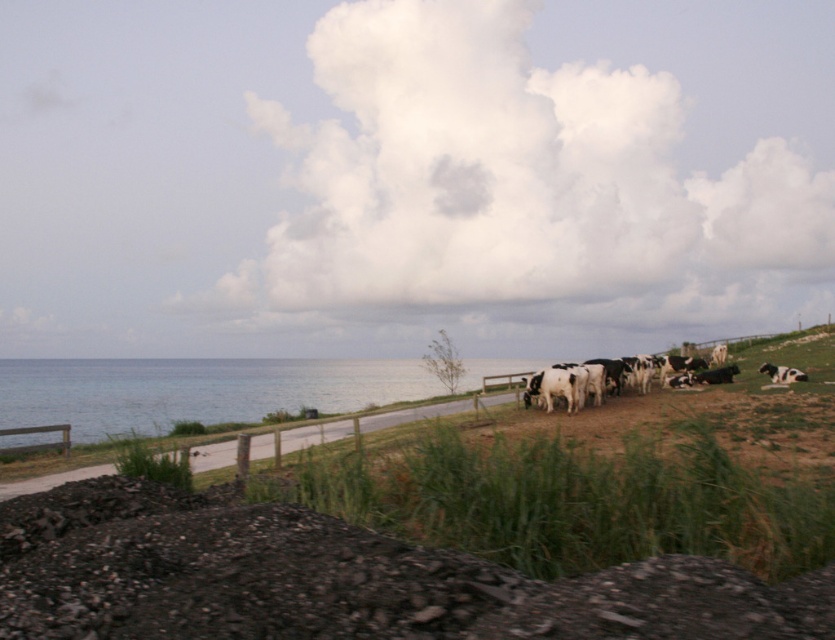
Does blue water at lower left have a lesser height compared to smooth concrete road at lower center?

In fact, blue water at lower left may be taller than smooth concrete road at lower center.

Image resolution: width=835 pixels, height=640 pixels. Identify the location of blue water at lower left. (195, 390).

Between point (175, 380) and point (0, 497), which one is positioned in front?

Point (0, 497) is more forward.

I want to click on blue water at lower left, so click(x=195, y=390).

Is point (206, 400) positioned after point (785, 371)?

Yes.

Does point (64, 408) lie in front of point (792, 368)?

No, it is behind (792, 368).

I want to click on blue water at lower left, so click(195, 390).

Between green grass at center and smooth concrete road at lower center, which one has more height?

green grass at center

Who is more forward, (800, 564) or (21, 483)?

Positioned in front is point (800, 564).

You are a GUI agent. You are given a task and a screenshot of the screen. Output one action in this format:
    pyautogui.click(x=<x>, y=<y>)
    Task: Click on the green grass at center
    
    Given the screenshot: What is the action you would take?
    pyautogui.click(x=565, y=499)